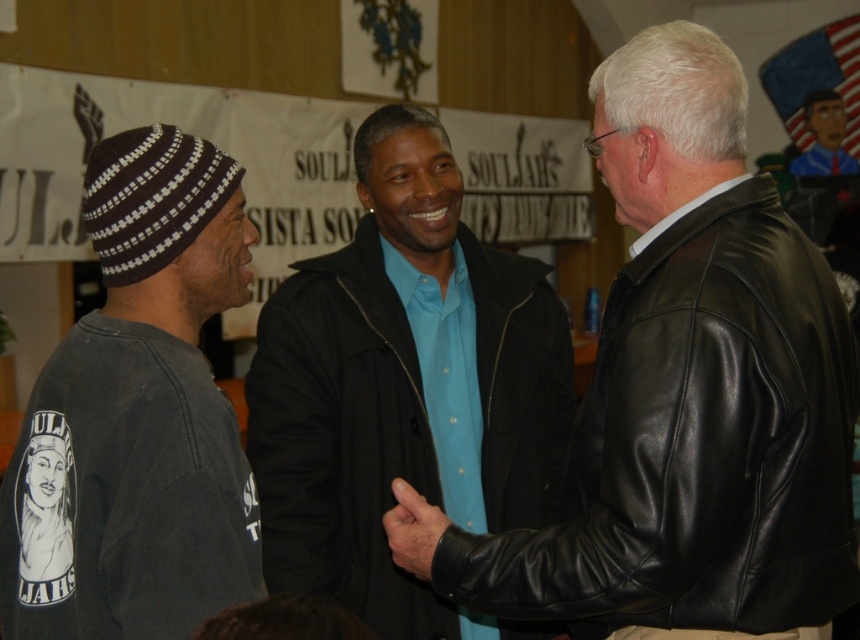
Based on the photo, is blue matte jacket at center below dark gray knit beanie at left?

Actually, blue matte jacket at center is above dark gray knit beanie at left.

Is the position of blue matte jacket at center less distant than that of dark gray knit beanie at left?

That is False.

Where is `blue matte jacket at center`? blue matte jacket at center is located at coordinates (404, 388).

Based on the photo, is blue matte jacket at center bigger than blue shirt at center?

Yes.

Which is in front, point (452, 408) or point (838, 157)?

Point (452, 408) is more forward.

Measure the distance between point [459,172] and camera.

They are 9.40 feet apart.

The width and height of the screenshot is (860, 640). Identify the location of blue matte jacket at center. (404, 388).

Does black leather jacket at right have a lesser height compared to blue matte jacket at center?

Yes, black leather jacket at right is shorter than blue matte jacket at center.

Which of these two, black leather jacket at right or blue matte jacket at center, stands taller?

Standing taller between the two is blue matte jacket at center.

The height and width of the screenshot is (640, 860). What do you see at coordinates (685, 394) in the screenshot? I see `black leather jacket at right` at bounding box center [685, 394].

Locate an element on the screen. black leather jacket at right is located at coordinates (685, 394).